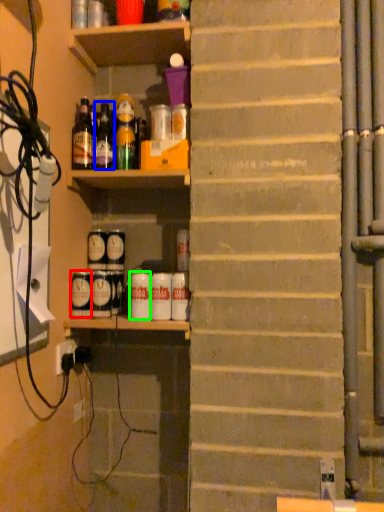
Question: Considering the real-world distances, which object is farthest from beverage (highlighted by a red box)? bottle (highlighted by a blue box) or beverage (highlighted by a green box)?

Choices:
 (A) bottle
 (B) beverage

Answer: (A)